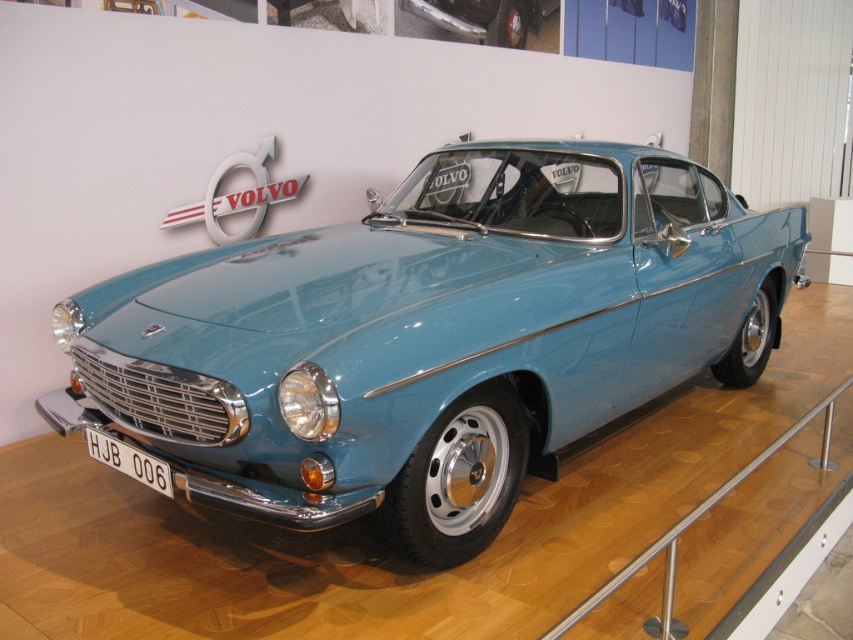
Question: Can you confirm if silver/metallic rail at lower right is smaller than white plastic license plate at front?

Choices:
 (A) yes
 (B) no

Answer: (B)

Question: Is light blue metallic car at center below metallic blue car at center?

Choices:
 (A) yes
 (B) no

Answer: (A)

Question: Which point is closer to the camera?

Choices:
 (A) silver/metallic rail at lower right
 (B) metallic blue car at center
 (C) light blue metallic car at center
 (D) white plastic license plate at front

Answer: (A)

Question: Among these points, which one is farthest from the camera?

Choices:
 (A) (498, 45)
 (B) (543, 182)

Answer: (A)

Question: Which of these objects is positioned farthest from the silver/metallic rail at lower right?

Choices:
 (A) white plastic license plate at front
 (B) light blue metallic car at center
 (C) metallic blue car at center

Answer: (C)

Question: Can you confirm if silver/metallic rail at lower right is bigger than white plastic license plate at front?

Choices:
 (A) yes
 (B) no

Answer: (A)